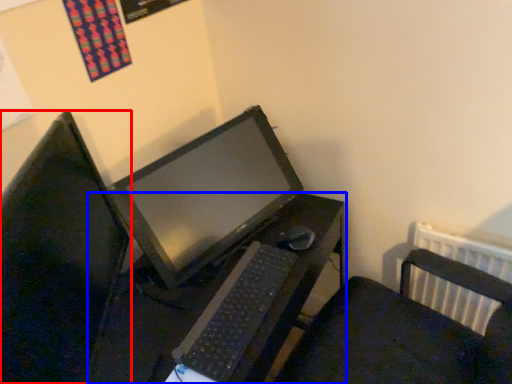
Question: Which of the following is the farthest to the observer, computer monitor (highlighted by a red box) or desk (highlighted by a blue box)?

Choices:
 (A) computer monitor
 (B) desk

Answer: (B)